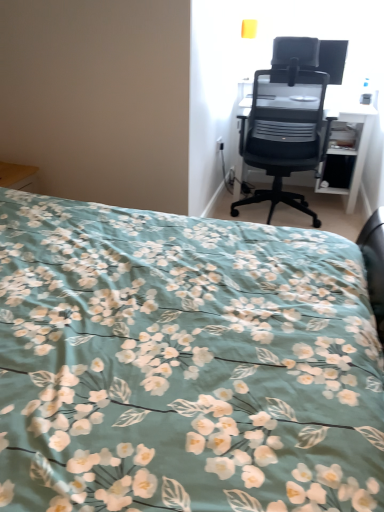
Image resolution: width=384 pixels, height=512 pixels. Identify the location of teal floral fabric bed at lower left. (183, 364).

The image size is (384, 512). Describe the element at coordinates (183, 364) in the screenshot. I see `teal floral fabric bed at lower left` at that location.

Find the location of a particular element. teal floral fabric bed at lower left is located at coordinates (183, 364).